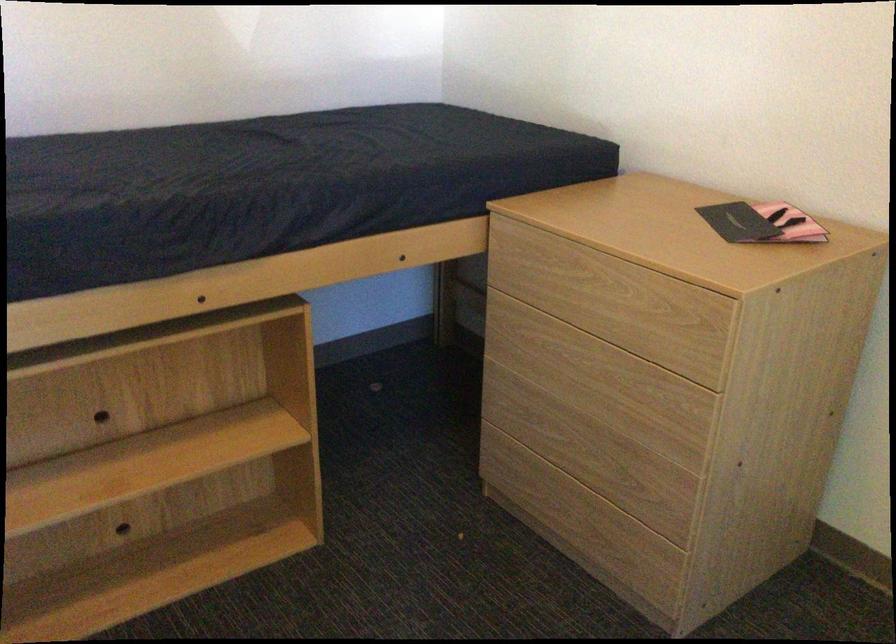
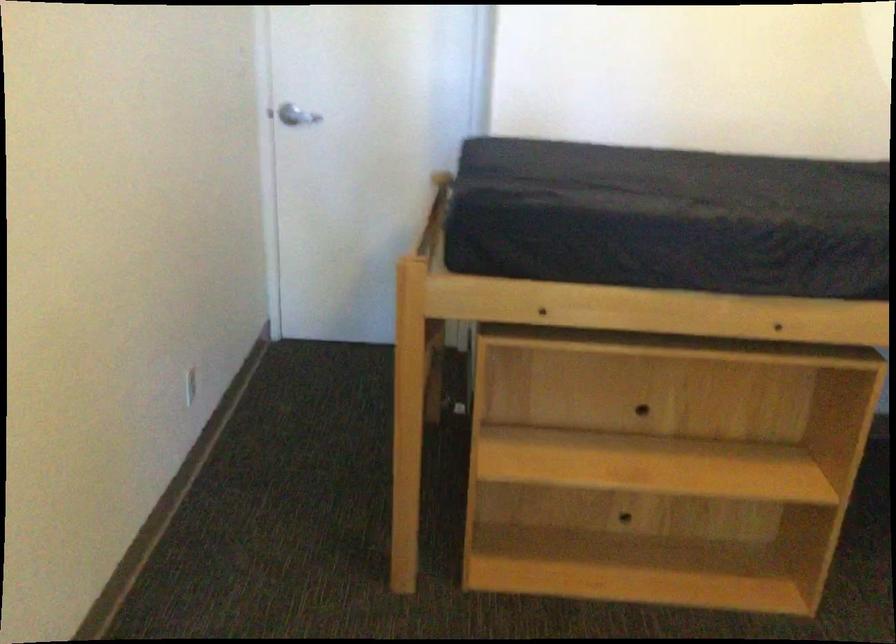
The point at [90,404] is marked in the first image. Where is the corresponding point in the second image?

(633, 395)